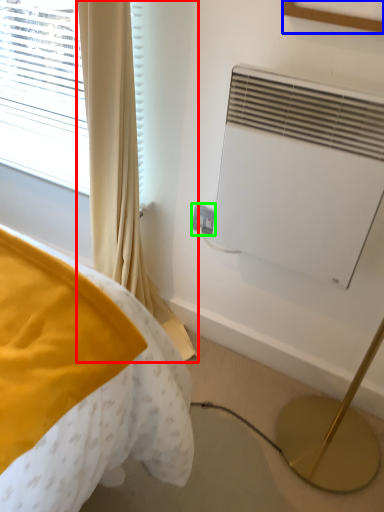
Question: Estimate the real-world distances between objects in this image. Which object is closer to curtain (highlighted by a red box), picture frame (highlighted by a blue box) or electric outlet (highlighted by a green box)?

Choices:
 (A) picture frame
 (B) electric outlet

Answer: (B)